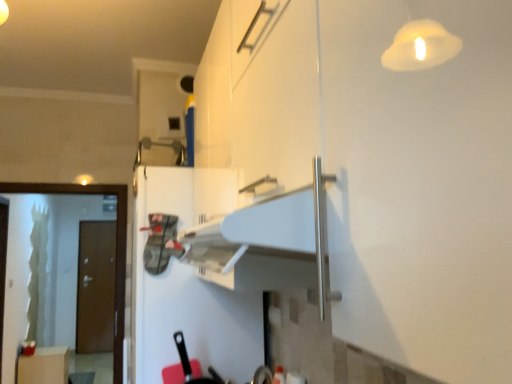
Question: From the image's perspective, is brown matte door at left on green frosted glass screen door at left?

Choices:
 (A) no
 (B) yes

Answer: (A)

Question: Considering the relative sizes of brown matte door at left and green frosted glass screen door at left in the image provided, is brown matte door at left bigger than green frosted glass screen door at left?

Choices:
 (A) yes
 (B) no

Answer: (B)

Question: Is brown matte door at left closer to the viewer compared to green frosted glass screen door at left?

Choices:
 (A) no
 (B) yes

Answer: (A)

Question: From a real-world perspective, is brown matte door at left below green frosted glass screen door at left?

Choices:
 (A) yes
 (B) no

Answer: (A)

Question: Does brown matte door at left have a greater height compared to green frosted glass screen door at left?

Choices:
 (A) yes
 (B) no

Answer: (A)

Question: Is the position of brown matte door at left more distant than that of green frosted glass screen door at left?

Choices:
 (A) yes
 (B) no

Answer: (A)

Question: Is brown matte door at left next to white matte refrigerator at center and touching it?

Choices:
 (A) yes
 (B) no

Answer: (B)

Question: Is brown matte door at left far from white matte refrigerator at center?

Choices:
 (A) no
 (B) yes

Answer: (B)

Question: From a real-world perspective, is brown matte door at left on white matte refrigerator at center?

Choices:
 (A) yes
 (B) no

Answer: (B)

Question: Is brown matte door at left oriented away from white matte refrigerator at center?

Choices:
 (A) yes
 (B) no

Answer: (B)

Question: From a real-world perspective, is brown matte door at left located beneath white matte refrigerator at center?

Choices:
 (A) yes
 (B) no

Answer: (A)

Question: Is brown matte door at left taller than white matte refrigerator at center?

Choices:
 (A) no
 (B) yes

Answer: (B)

Question: Is green frosted glass screen door at left positioned far away from matte white cabinet at lower left?

Choices:
 (A) yes
 (B) no

Answer: (A)